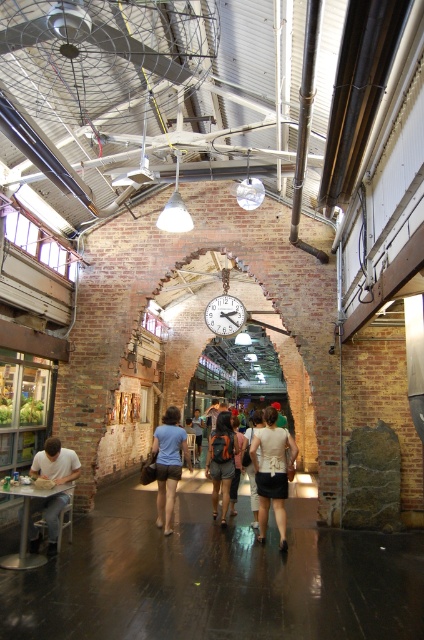
Does white matte shirt at center have a greater height compared to blue denim shorts at center?

Correct, white matte shirt at center is much taller as blue denim shorts at center.

Is white matte shirt at center closer to camera compared to blue denim shorts at center?

That is True.

You are a GUI agent. You are given a task and a screenshot of the screen. Output one action in this format:
    pyautogui.click(x=<x>, y=<y>)
    Task: Click on the white matte shirt at center
    
    Given the screenshot: What is the action you would take?
    pyautogui.click(x=272, y=472)

Who is shorter, white matte shirt at center or matte white shirt at lower left?

With less height is matte white shirt at lower left.

Image resolution: width=424 pixels, height=640 pixels. What are the coordinates of `white matte shirt at center` in the screenshot? It's located at (272, 472).

The width and height of the screenshot is (424, 640). I want to click on white matte shirt at center, so click(x=272, y=472).

Who is higher up, matte white shirt at lower left or metallic/brass clock at center?

Positioned higher is metallic/brass clock at center.

Is matte white shirt at lower left to the right of metallic/brass clock at center from the viewer's perspective?

No, matte white shirt at lower left is not to the right of metallic/brass clock at center.

Is point (58, 440) in front of point (225, 294)?

Yes, point (58, 440) is closer to viewer.

Where is `matte white shirt at lower left`? The height and width of the screenshot is (640, 424). matte white shirt at lower left is located at coordinates point(55,461).